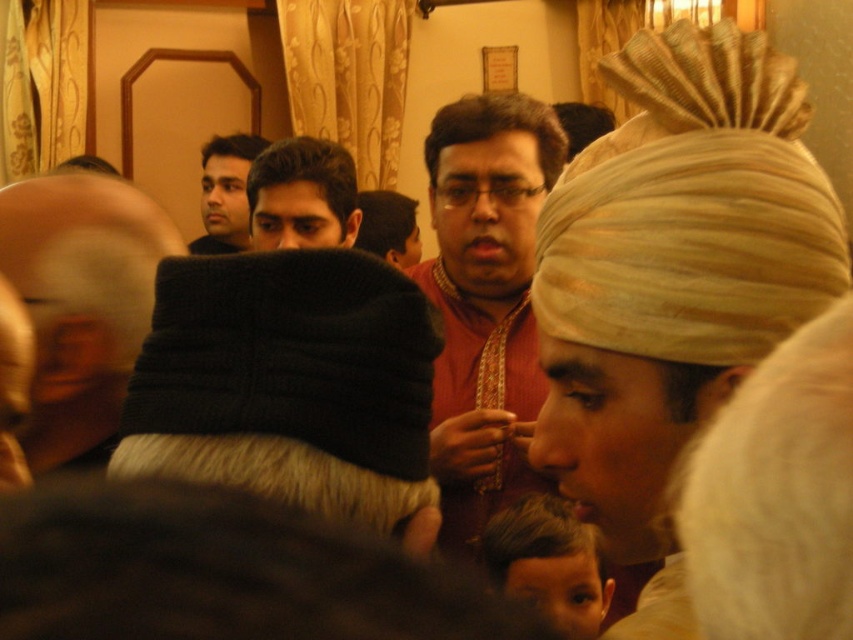
Question: Does black knitted hat at left appear on the right side of matte gold turban at center?

Choices:
 (A) no
 (B) yes

Answer: (A)

Question: Which of the following is the farthest from the observer?

Choices:
 (A) (495, 572)
 (B) (250, 172)

Answer: (B)

Question: Which point appears closest to the camera in this image?

Choices:
 (A) (500, 433)
 (B) (554, 570)
 (C) (276, 211)
 (D) (524, 266)

Answer: (B)

Question: Does matte black head at upper center appear on the left side of black knit cap at lower left?

Choices:
 (A) no
 (B) yes

Answer: (B)

Question: Can you confirm if beige textured turban at center is positioned above black knitted hat at left?

Choices:
 (A) no
 (B) yes

Answer: (B)

Question: Among these objects, which one is nearest to the camera?

Choices:
 (A) beige textured turban at center
 (B) matte red kurta at center
 (C) matte gold turban at center

Answer: (A)